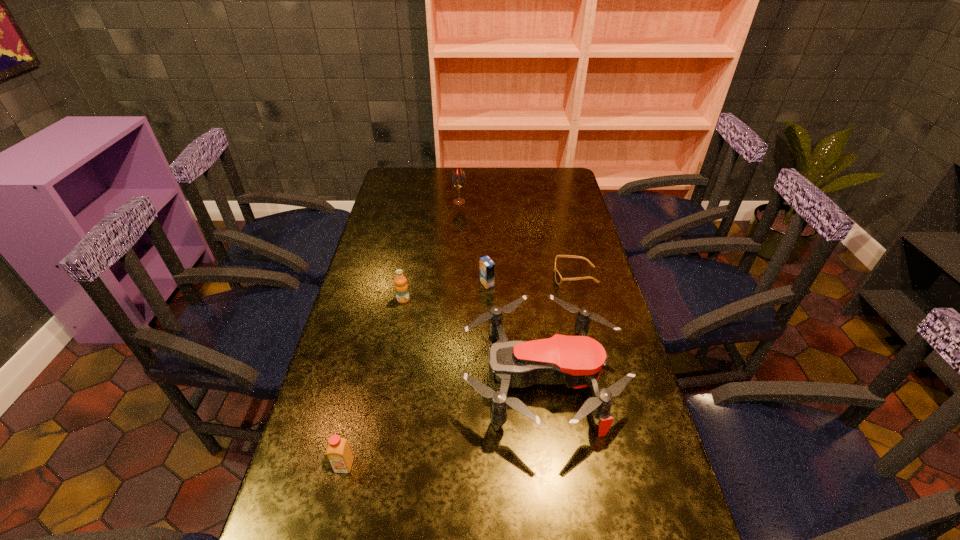
At what (x,y) coordinates should I click in order to perform the action: click on vacant space that is in between the leftmost object and the wineglass. Please return your answer as a coordinate pair (x, y). The width and height of the screenshot is (960, 540). Looking at the image, I should click on (402, 334).

Find the location of a particular element. The height and width of the screenshot is (540, 960). empty space that is in between the third nearest object and the shortest orange_juice is located at coordinates (445, 292).

The width and height of the screenshot is (960, 540). What are the coordinates of `free spot between the leftmost orange_juice and the farthest orange_juice` in the screenshot? It's located at (416, 374).

Identify which object is the fifth nearest to the sunglasses. Please provide its 2D coordinates. Your answer should be formatted as a tuple, i.e. [(x, y)], where the tuple contains the x and y coordinates of a point satisfying the conditions above.

[(338, 451)]

This screenshot has width=960, height=540. In order to click on the fifth closest object to the sunglasses in this screenshot , I will do pos(338,451).

Identify which orange_juice is the second closest to the shortest orange_juice. Please provide its 2D coordinates. Your answer should be formatted as a tuple, i.e. [(x, y)], where the tuple contains the x and y coordinates of a point satisfying the conditions above.

[(338, 451)]

This screenshot has height=540, width=960. Identify the location of the closest orange_juice to the drone. (487, 267).

At what (x,y) coordinates should I click in order to perform the action: click on free spot that satisfies the following two spatial constraints: 1. on the front-facing side of the shortest object; 2. on the front side of the rightmost orange_juice. Please return your answer as a coordinate pair (x, y). The width and height of the screenshot is (960, 540). Looking at the image, I should click on (577, 284).